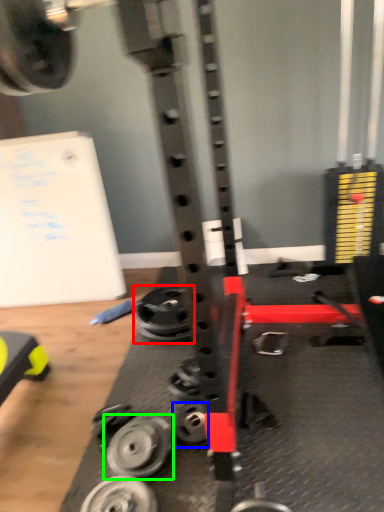
Question: Which object is positioned farthest from wheel (highlighted by a red box)? Select from wheel (highlighted by a blue box) and wheel (highlighted by a green box).

Choices:
 (A) wheel
 (B) wheel

Answer: (B)